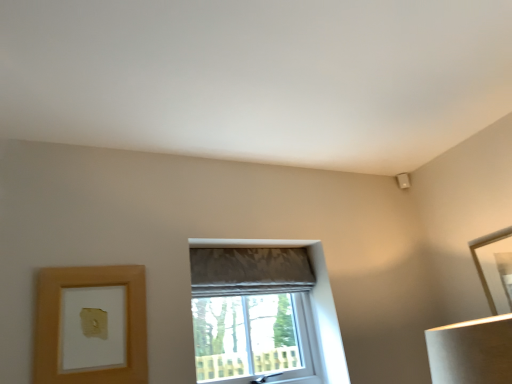
Question: Is matte gray curtain at center facing towards gold metallic picture frame at upper right, the second picture frame viewed from the left?

Choices:
 (A) yes
 (B) no

Answer: (B)

Question: From a real-world perspective, is matte gray curtain at center located higher than gold metallic picture frame at upper right, which is the 2th picture frame from front to back?

Choices:
 (A) no
 (B) yes

Answer: (B)

Question: Can you confirm if matte gray curtain at center is thinner than gold metallic picture frame at upper right, which is the 2th picture frame from front to back?

Choices:
 (A) yes
 (B) no

Answer: (B)

Question: Is matte gray curtain at center not inside gold metallic picture frame at upper right, placed as the 1th picture frame when sorted from back to front?

Choices:
 (A) yes
 (B) no

Answer: (A)

Question: From the image's perspective, is matte gray curtain at center on gold metallic picture frame at upper right, acting as the first picture frame starting from the right?

Choices:
 (A) yes
 (B) no

Answer: (B)

Question: Is matte gray curtain at center positioned far away from gold metallic picture frame at upper right, acting as the first picture frame starting from the right?

Choices:
 (A) no
 (B) yes

Answer: (B)

Question: From a real-world perspective, is gold metallic picture frame at upper right, acting as the first picture frame starting from the right, positioned over matte gray curtain at center based on gravity?

Choices:
 (A) no
 (B) yes

Answer: (A)

Question: Considering the relative sizes of gold metallic picture frame at upper right, placed as the 1th picture frame when sorted from back to front, and matte gray curtain at center in the image provided, is gold metallic picture frame at upper right, placed as the 1th picture frame when sorted from back to front, smaller than matte gray curtain at center?

Choices:
 (A) yes
 (B) no

Answer: (A)

Question: Does gold metallic picture frame at upper right, acting as the first picture frame starting from the right, appear on the right side of matte gray curtain at center?

Choices:
 (A) yes
 (B) no

Answer: (A)

Question: Are gold metallic picture frame at upper right, the second picture frame viewed from the left, and matte gray curtain at center located far from each other?

Choices:
 (A) no
 (B) yes

Answer: (B)

Question: Is gold metallic picture frame at upper right, placed as the 1th picture frame when sorted from back to front, looking in the opposite direction of matte gray curtain at center?

Choices:
 (A) yes
 (B) no

Answer: (B)

Question: Does gold metallic picture frame at upper right, acting as the first picture frame starting from the right, turn towards matte gray curtain at center?

Choices:
 (A) no
 (B) yes

Answer: (A)

Question: Is matte gray fabric window at center at the right side of matte gray curtain at center?

Choices:
 (A) no
 (B) yes

Answer: (B)